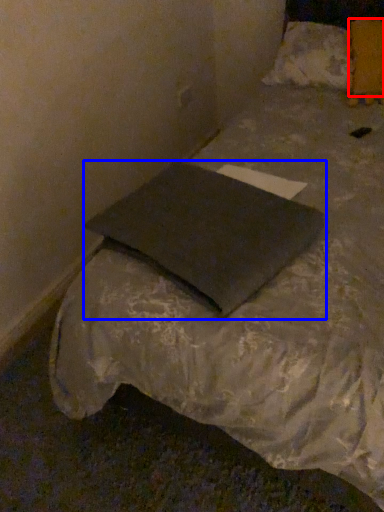
Question: Among these objects, which one is farthest to the camera, pillow (highlighted by a red box) or pillow (highlighted by a blue box)?

Choices:
 (A) pillow
 (B) pillow

Answer: (A)